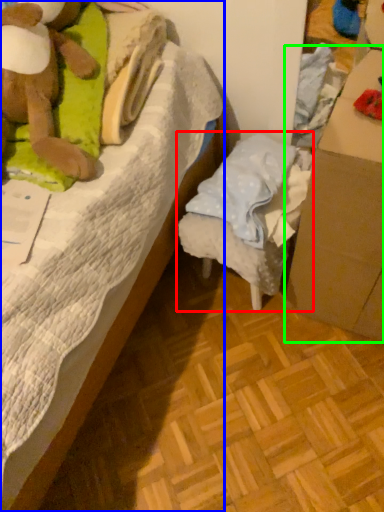
Question: Estimate the real-world distances between objects in this image. Which object is farther from furniture (highlighted by a red box), bed (highlighted by a blue box) or cardboard box (highlighted by a green box)?

Choices:
 (A) bed
 (B) cardboard box

Answer: (A)